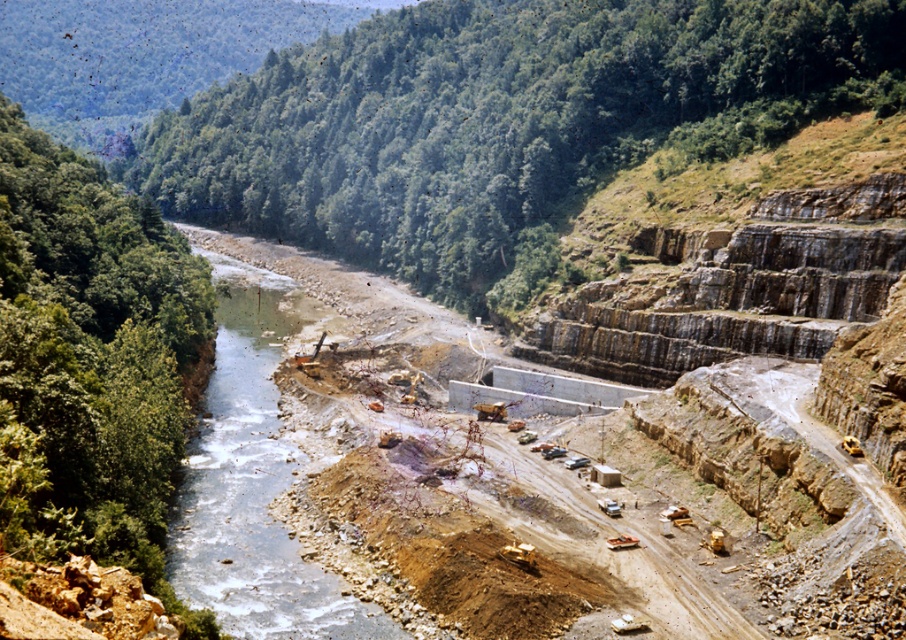
You are a safety inspector standing at the edge of the construction site. You need to check the water quality of the clear water at center. Given that your water testing kit has a maximum reach of 70 meters, can you safely test the water without entering the hazardous construction area?

The clear water at center is 73.69 meters away from the viewer, which exceeds the testing kit range of 70 meters. Therefore, you cannot safely test the water without entering the hazardous construction area.

You are an environmental inspector assessing the river health. You observe the clear water at center and the brown rocky construction site at center. Which of these two is lower in elevation?

The clear water at center is lower in elevation than the brown rocky construction site at center because it is shorter in height.